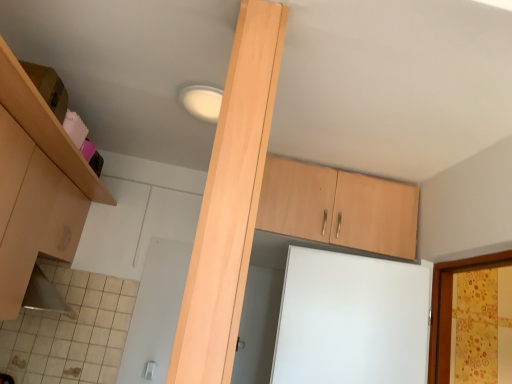
Question: From a real-world perspective, relative to light wood beam at center, is matte wood cabinet at upper left, which is counted as the first cabinetry, starting from the left, vertically above or below?

Choices:
 (A) above
 (B) below

Answer: (B)

Question: Is point (8, 71) positioned closer to the camera than point (187, 355)?

Choices:
 (A) closer
 (B) farther

Answer: (B)

Question: Considering the real-world distances, which object is farthest from the light wood beam at center?

Choices:
 (A) light wood cabinet at upper center, acting as the first cabinetry starting from the right
 (B) matte wood cabinet at upper left, positioned as the 2th cabinetry in right-to-left order

Answer: (A)

Question: Which is farther from the light wood cabinet at upper center, acting as the first cabinetry starting from the right?

Choices:
 (A) matte wood cabinet at upper left, which is counted as the first cabinetry, starting from the left
 (B) light wood beam at center

Answer: (B)